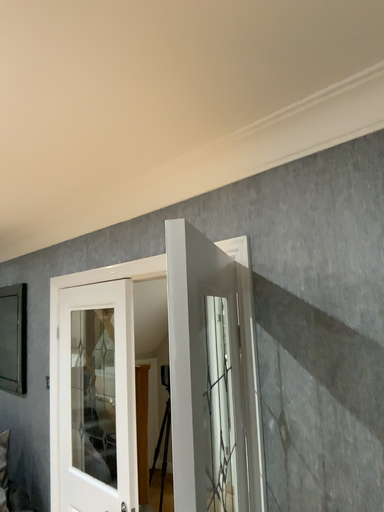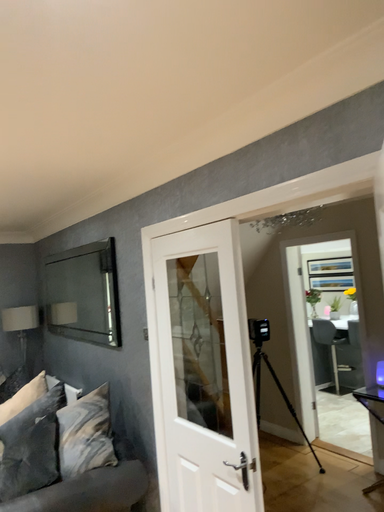
Question: Which way did the camera rotate in the video?

Choices:
 (A) rotated left
 (B) rotated right

Answer: (A)